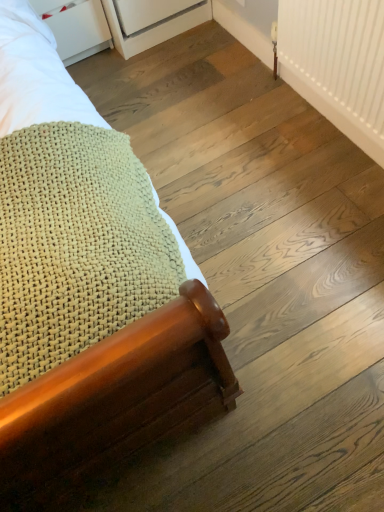
The height and width of the screenshot is (512, 384). I want to click on vacant region below white plastic radiator at upper right (from a real-world perspective), so click(316, 124).